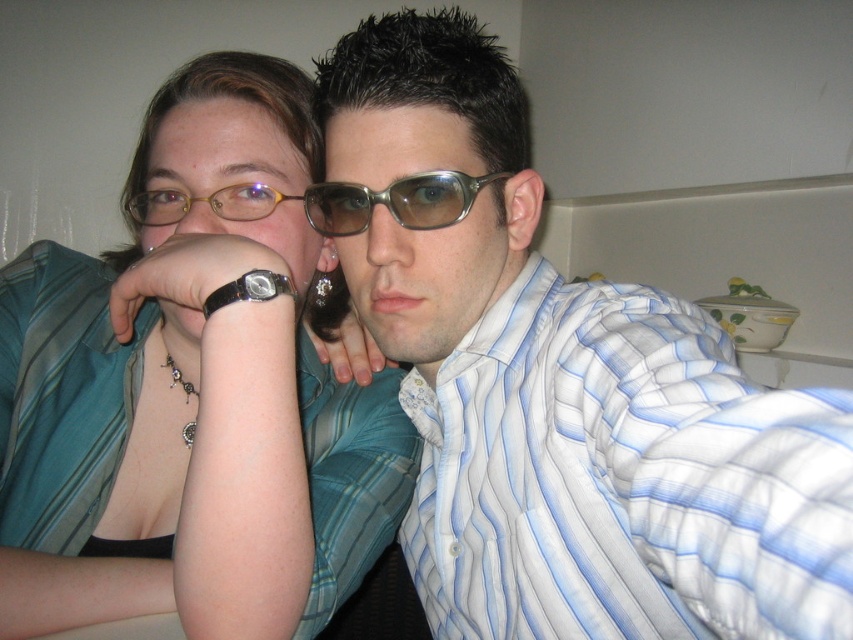
Is point (219, 499) behind point (335, 196)?

No, (219, 499) is in front of (335, 196).

Does matte teal blouse at center have a greater width compared to metallic frame glasses at center?

Yes.

Where is `matte teal blouse at center`? The width and height of the screenshot is (853, 640). matte teal blouse at center is located at coordinates (184, 440).

Looking at this image, is matte blue striped shirt at center below matte teal blouse at center?

Yes, matte blue striped shirt at center is below matte teal blouse at center.

Can you confirm if matte blue striped shirt at center is bigger than matte teal blouse at center?

Indeed, matte blue striped shirt at center has a larger size compared to matte teal blouse at center.

Who is more distant from viewer, [727,404] or [206,484]?

The point [206,484] is more distant.

I want to click on matte blue striped shirt at center, so click(567, 394).

Locate an element on the screen. matte blue striped shirt at center is located at coordinates (567, 394).

Is matte blue striped shirt at center further to camera compared to gold plastic glasses at upper center?

No.

Between point (721, 541) and point (276, 198), which one is positioned behind?

Point (276, 198)

Locate an element on the screen. This screenshot has height=640, width=853. matte blue striped shirt at center is located at coordinates (567, 394).